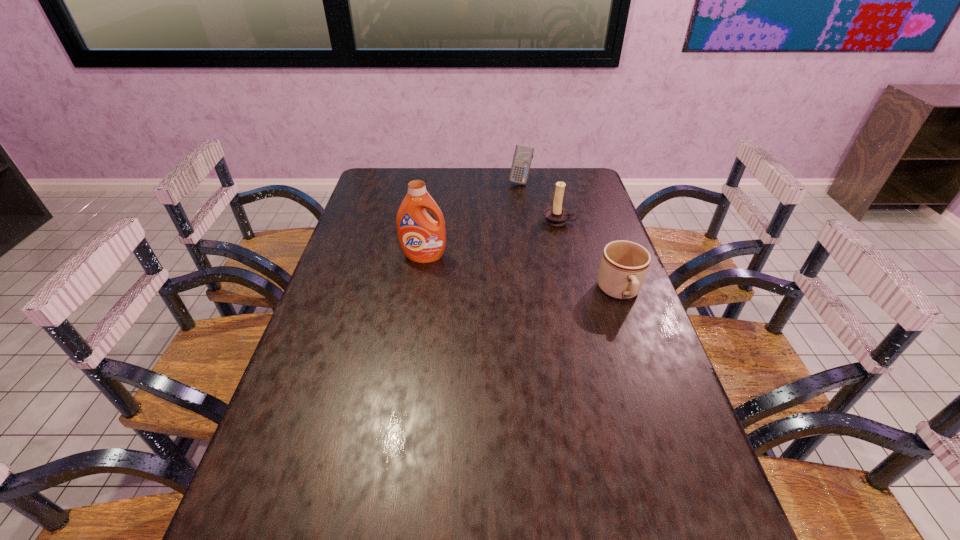
You are a GUI agent. You are given a task and a screenshot of the screen. Output one action in this format:
    pyautogui.click(x=<x>, y=<y>)
    Task: Click on the free space at the left edge of the desktop
    This screenshot has height=540, width=960.
    Given the screenshot: What is the action you would take?
    pyautogui.click(x=344, y=280)

Where is `vacant space at the right edge of the desktop`? vacant space at the right edge of the desktop is located at coordinates (647, 437).

The width and height of the screenshot is (960, 540). I want to click on vacant space at the far right corner of the desktop, so click(x=556, y=186).

Identify the location of blank space at the near right corner of the desktop. The image size is (960, 540). (635, 494).

Image resolution: width=960 pixels, height=540 pixels. What are the coordinates of `unoccupied position between the calculator and the third nearest object` in the screenshot? It's located at (540, 201).

This screenshot has height=540, width=960. I want to click on empty location between the farthest object and the leftmost object, so click(x=472, y=219).

At what (x,y) coordinates should I click in order to perform the action: click on free space between the shortest object and the second farthest object. Please return your answer as a coordinate pair (x, y). Looking at the image, I should click on (589, 256).

You are a GUI agent. You are given a task and a screenshot of the screen. Output one action in this format:
    pyautogui.click(x=<x>, y=<y>)
    Task: Click on the unoccupied area between the third object from right to left and the candle holder
    The width and height of the screenshot is (960, 540).
    Given the screenshot: What is the action you would take?
    pyautogui.click(x=540, y=201)

This screenshot has height=540, width=960. I want to click on empty location between the second nearest object and the second object from right to left, so [492, 239].

The height and width of the screenshot is (540, 960). Identify the location of unoccupied area between the second object from left to right and the nearest object. (570, 237).